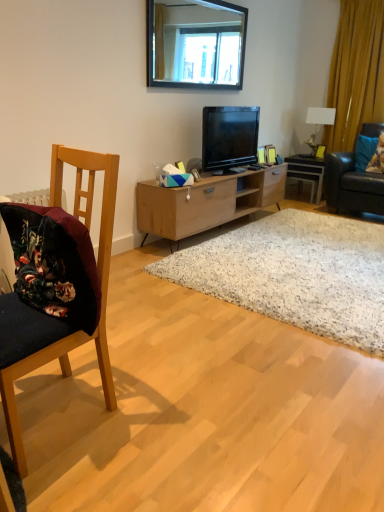
Question: From the image's perspective, is white speckled rug at center located above or below light wood cabinet at center?

Choices:
 (A) below
 (B) above

Answer: (A)

Question: Considering the positions of point (264, 301) and point (160, 219), is point (264, 301) closer or farther from the camera than point (160, 219)?

Choices:
 (A) farther
 (B) closer

Answer: (B)

Question: Estimate the real-world distances between objects in this image. Which object is farther from the white glossy lamp at upper right?

Choices:
 (A) blue fabric pillow at right, the 2th pillow viewed from the right
 (B) blue fabric pillow at right, which is the 1th pillow in right-to-left order
 (C) black glass mirror at upper center
 (D) wooden picture frame at upper center
 (E) wooden desk at center

Answer: (C)

Question: Which of these objects is positioned farthest from the wooden picture frame at upper center?

Choices:
 (A) white glossy lamp at upper right
 (B) black glossy television at center
 (C) yellow fabric curtain at right
 (D) light wood cabinet at center
 (E) velvet dark blue chair at left

Answer: (E)